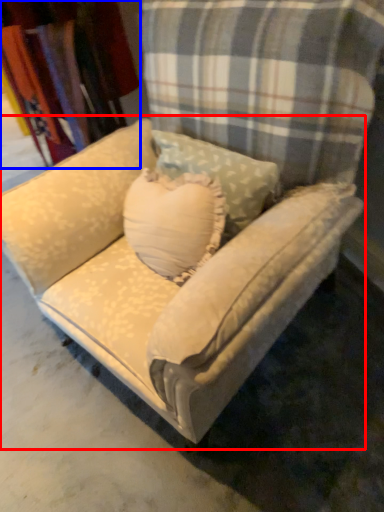
Question: Which object appears farthest to the camera in this image, studio couch (highlighted by a red box) or fabric (highlighted by a blue box)?

Choices:
 (A) studio couch
 (B) fabric

Answer: (B)